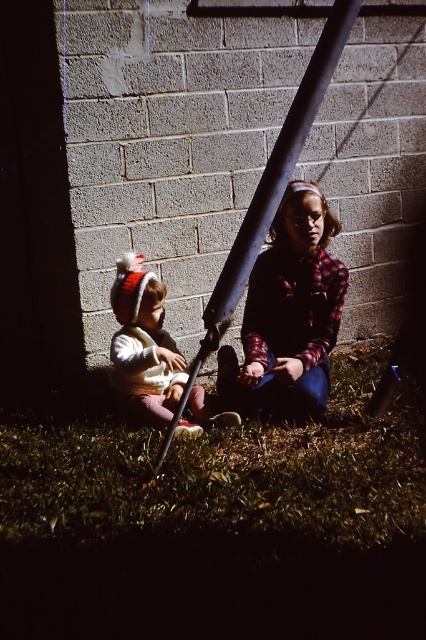
You are standing at the point with coordinates point (118,280) and want to walk to the point with coordinates point (238,291). Which direction should you move in to reach your destination?

You should move forward because point (238,291) is in front of point (118,280).

You are a photographer trying to capture a portrait of the two people in the scene. You want to ensure the green grass at lower center and the metallic pole at center are both visible in the frame. Based on their positions, which object is closer to the left edge of the photo?

The green grass at lower center is positioned on the left side of metallic pole at center, so it will be closer to the left edge of the photo.